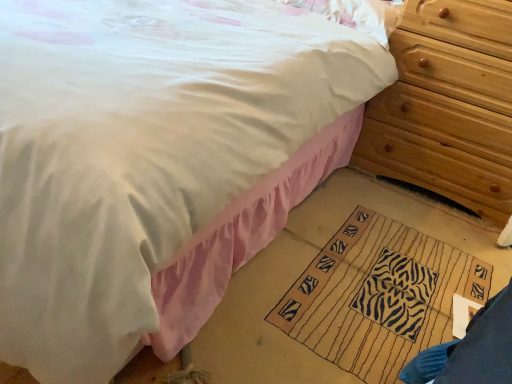
Question: Can you confirm if wooden chest of drawers at right is positioned to the right of white satin pillow at upper center?

Choices:
 (A) yes
 (B) no

Answer: (A)

Question: Can you confirm if wooden chest of drawers at right is positioned to the left of white satin pillow at upper center?

Choices:
 (A) no
 (B) yes

Answer: (A)

Question: From a real-world perspective, does wooden chest of drawers at right stand above white satin pillow at upper center?

Choices:
 (A) no
 (B) yes

Answer: (A)

Question: Is white satin pillow at upper center surrounded by wooden chest of drawers at right?

Choices:
 (A) yes
 (B) no

Answer: (B)

Question: Is wooden chest of drawers at right with white satin pillow at upper center?

Choices:
 (A) no
 (B) yes

Answer: (A)

Question: Is white satin pillow at upper center situated inside beige woven mat at lower center or outside?

Choices:
 (A) inside
 (B) outside

Answer: (B)

Question: Is white satin pillow at upper center wider or thinner than beige woven mat at lower center?

Choices:
 (A) wide
 (B) thin

Answer: (B)

Question: From the image's perspective, relative to beige woven mat at lower center, is white satin pillow at upper center above or below?

Choices:
 (A) above
 (B) below

Answer: (A)

Question: Relative to beige woven mat at lower center, is white satin pillow at upper center in front or behind?

Choices:
 (A) behind
 (B) front

Answer: (A)

Question: Considering the positions of beige woven mat at lower center and wooden chest of drawers at right in the image, is beige woven mat at lower center bigger or smaller than wooden chest of drawers at right?

Choices:
 (A) big
 (B) small

Answer: (B)

Question: From the image's perspective, is beige woven mat at lower center positioned above or below wooden chest of drawers at right?

Choices:
 (A) above
 (B) below

Answer: (B)

Question: In the image, is beige woven mat at lower center positioned in front of or behind wooden chest of drawers at right?

Choices:
 (A) front
 (B) behind

Answer: (A)

Question: Is beige woven mat at lower center situated inside wooden chest of drawers at right or outside?

Choices:
 (A) inside
 (B) outside

Answer: (B)

Question: Considering their positions, is beige woven mat at lower center located in front of or behind white satin pillow at upper center?

Choices:
 (A) behind
 (B) front

Answer: (B)

Question: Considering the positions of beige woven mat at lower center and white satin pillow at upper center in the image, is beige woven mat at lower center bigger or smaller than white satin pillow at upper center?

Choices:
 (A) small
 (B) big

Answer: (A)